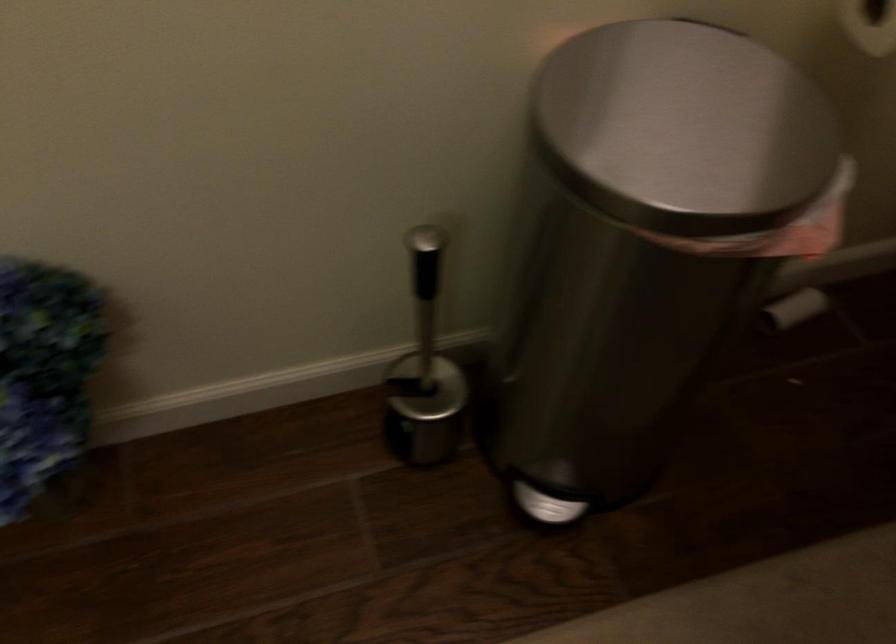
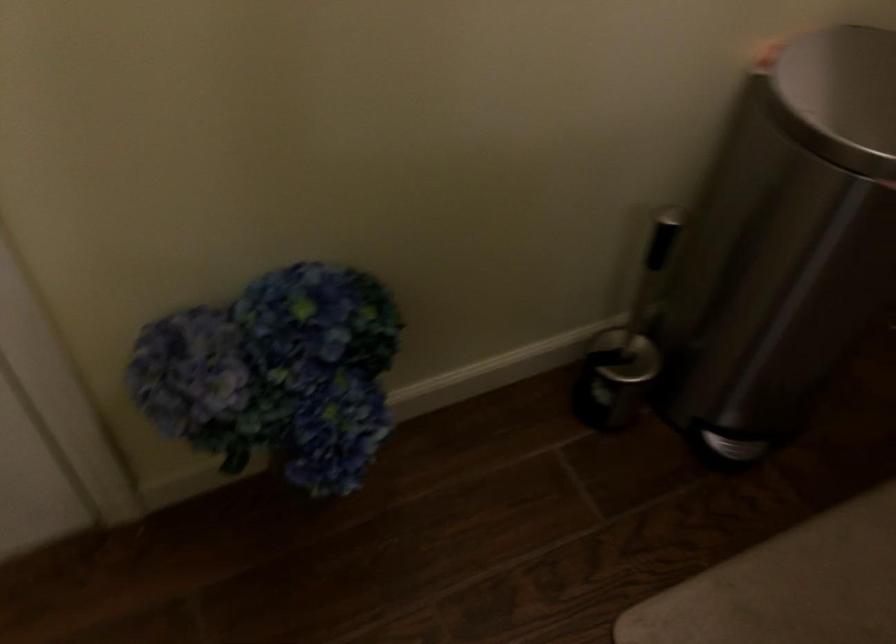
Question: The images are taken continuously from a first-person perspective. In which direction is your viewpoint rotating?

Choices:
 (A) Left
 (B) Right
 (C) Up
 (D) Down

Answer: (B)